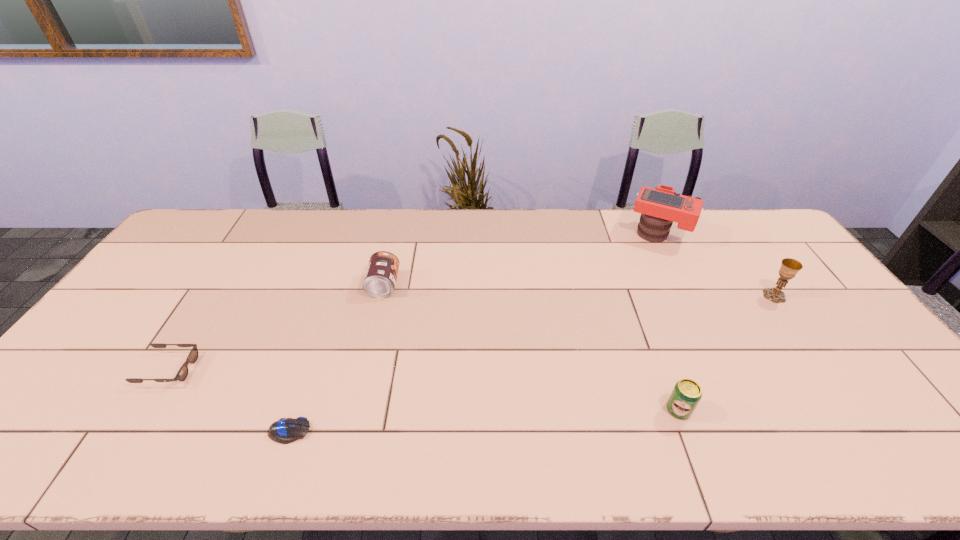
You are a GUI agent. You are given a task and a screenshot of the screen. Output one action in this format:
    pyautogui.click(x=<x>, y=<y>)
    Task: Click on the vacant space that is in between the fourth object from left to right and the chalice
    This screenshot has width=960, height=540.
    Given the screenshot: What is the action you would take?
    pyautogui.click(x=727, y=353)

Image resolution: width=960 pixels, height=540 pixels. I want to click on vacant area that lies between the third object from right to left and the third nearest object, so click(x=423, y=389).

Locate an element on the screen. Image resolution: width=960 pixels, height=540 pixels. vacant area that lies between the chalice and the can is located at coordinates point(579,291).

Select which object is the fifth closest to the fourth object from left to right. Please provide its 2D coordinates. Your answer should be formatted as a tuple, i.e. [(x, y)], where the tuple contains the x and y coordinates of a point satisfying the conditions above.

[(182, 374)]

This screenshot has width=960, height=540. Find the location of `object that stands as the second closest to the camera`. object that stands as the second closest to the camera is located at coordinates (686, 394).

Where is `free space that satisfies the following two spatial constraints: 1. on the front side of the camera; 2. on the button side of the computer mouse`? This screenshot has height=540, width=960. free space that satisfies the following two spatial constraints: 1. on the front side of the camera; 2. on the button side of the computer mouse is located at coordinates (756, 431).

This screenshot has height=540, width=960. I want to click on vacant space that satisfies the following two spatial constraints: 1. on the temples of the fourth object from left to right; 2. on the right side of the leftmost object, so click(x=143, y=409).

I want to click on vacant space that satisfies the following two spatial constraints: 1. on the front label of the chalice; 2. on the left side of the can, so click(x=381, y=296).

This screenshot has height=540, width=960. In order to click on free location that satisfies the following two spatial constraints: 1. on the front label of the can; 2. on the left side of the beer can in this screenshot , I will do `click(354, 409)`.

You are a GUI agent. You are given a task and a screenshot of the screen. Output one action in this format:
    pyautogui.click(x=<x>, y=<y>)
    Task: Click on the blank area in the image that satisfies the following two spatial constraints: 1. on the front label of the can; 2. on the right side of the beer can
    
    Given the screenshot: What is the action you would take?
    pyautogui.click(x=354, y=409)